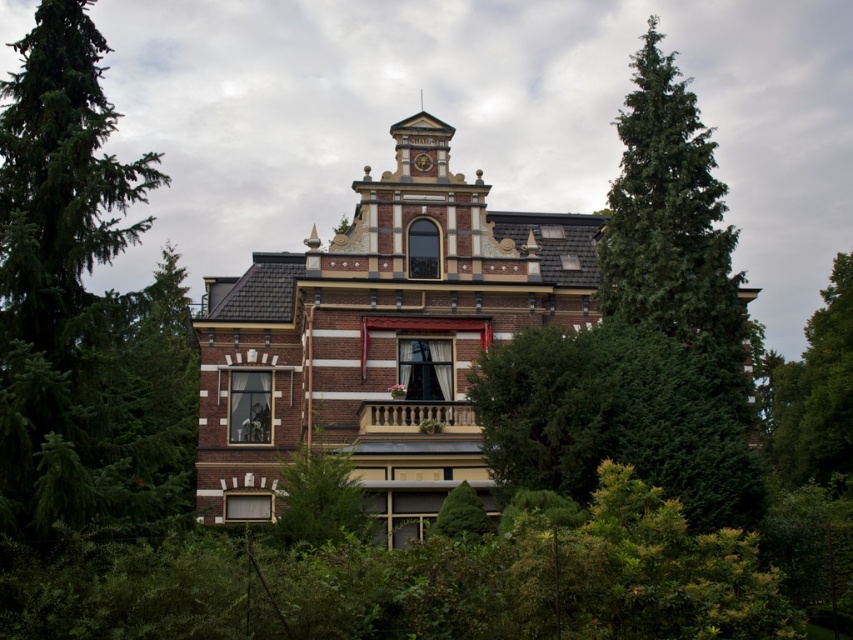
Question: Does green leafy tree at center have a lesser width compared to light brown wooden balcony at center?

Choices:
 (A) yes
 (B) no

Answer: (B)

Question: Can you confirm if green leafy tree at right is thinner than green leafy tree at lower center?

Choices:
 (A) yes
 (B) no

Answer: (B)

Question: Which point is farther from the camera taking this photo?

Choices:
 (A) (648, 122)
 (B) (592, 353)

Answer: (A)

Question: Can you confirm if green evergreen tree at left is wider than light brown wooden balcony at center?

Choices:
 (A) yes
 (B) no

Answer: (A)

Question: Which point is farther to the camera?

Choices:
 (A) (322, 541)
 (B) (827, 348)

Answer: (B)

Question: Which of the following is the closest to the observer?

Choices:
 (A) light brown wooden balcony at center
 (B) green needle-like foliage at right

Answer: (B)